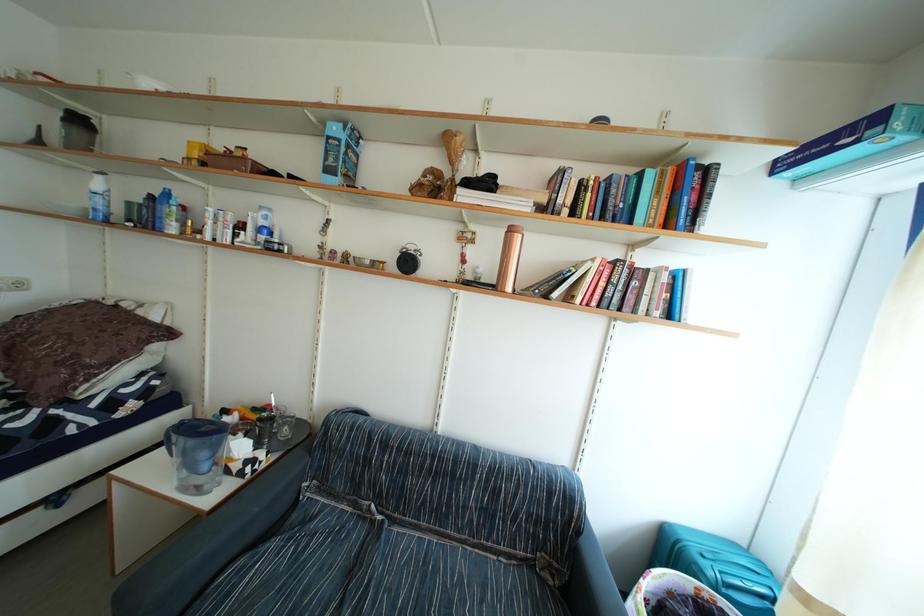
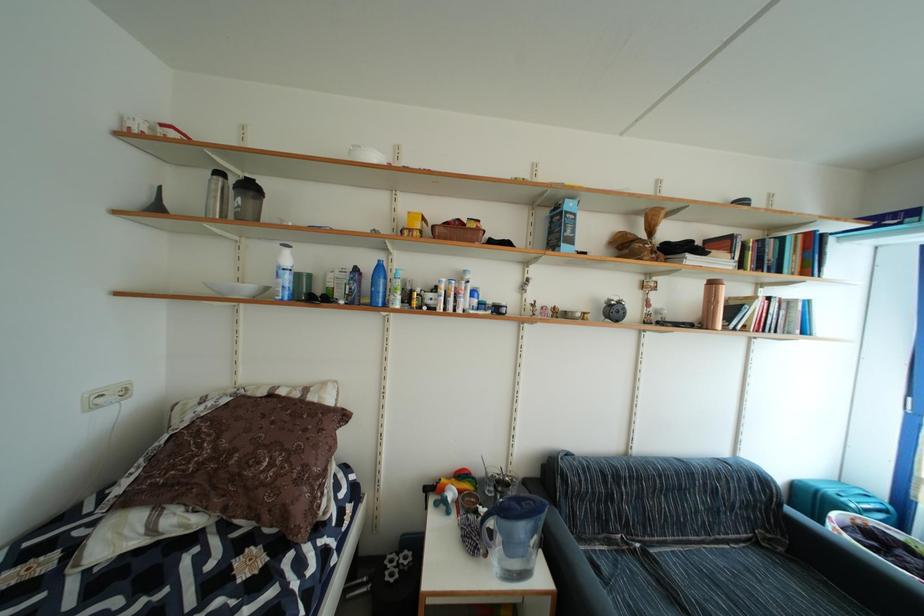
Question: Which direction would the cameraman need to move to produce the second image? Reply with the corresponding letter.

Choices:
 (A) Left
 (B) Right
 (C) Forward
 (D) Backward

Answer: (A)